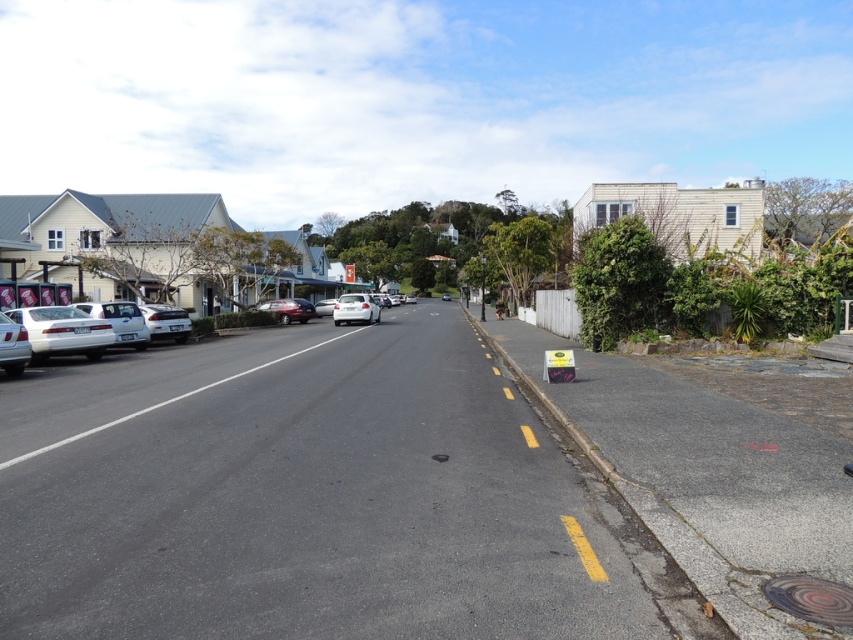
Question: Which is nearer to the silver metallic car at left?

Choices:
 (A) white glossy sedan at center
 (B) shiny silver sedan at left

Answer: (B)

Question: Which is nearer to the satin white sedan at center?

Choices:
 (A) shiny silver sedan at left
 (B) silver metallic car at left

Answer: (A)

Question: Can you confirm if satin white sedan at center is thinner than satin red car at center?

Choices:
 (A) no
 (B) yes

Answer: (A)

Question: Observing the image, what is the correct spatial positioning of silver metallic car at left in reference to satin white sedan at center?

Choices:
 (A) below
 (B) above

Answer: (A)

Question: Which object is positioned farthest from the satin red car at center?

Choices:
 (A) white glossy sedan at center
 (B) white glossy sedan at left

Answer: (B)

Question: Is white matte car at left closer to camera compared to satin white sedan at center?

Choices:
 (A) no
 (B) yes

Answer: (B)